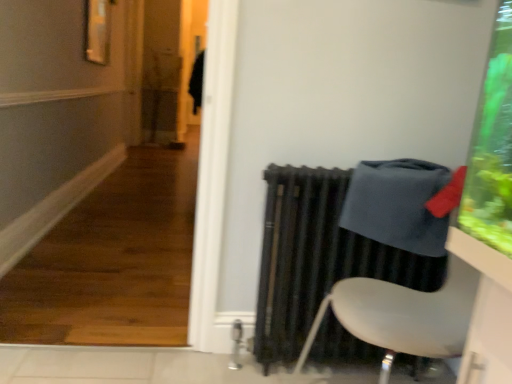
You are a GUI agent. You are given a task and a screenshot of the screen. Output one action in this format:
    pyautogui.click(x=<x>, y=<y>)
    Task: Click on the matte black radiator at lower right
    
    Given the screenshot: What is the action you would take?
    pyautogui.click(x=318, y=258)

This screenshot has height=384, width=512. Describe the element at coordinates (318, 258) in the screenshot. I see `matte black radiator at lower right` at that location.

Identify the location of matte black radiator at lower right. The width and height of the screenshot is (512, 384). (318, 258).